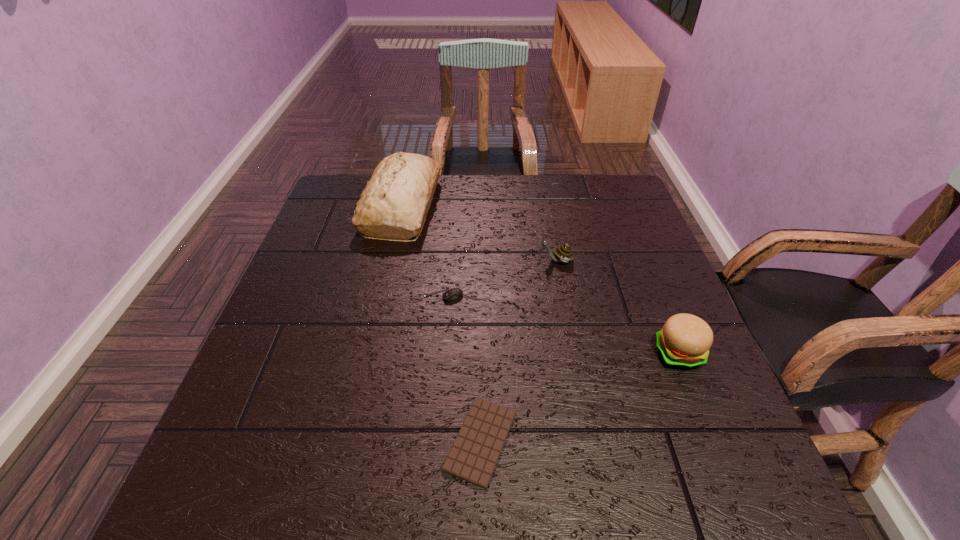
The width and height of the screenshot is (960, 540). Identify the location of vacant space located on the left of the tallest object. click(x=326, y=206).

Where is `free space located on the face of the second farthest object`? This screenshot has width=960, height=540. free space located on the face of the second farthest object is located at coordinates (409, 260).

Image resolution: width=960 pixels, height=540 pixels. In order to click on vacant region located on the face of the second farthest object in this screenshot , I will do (494, 260).

Image resolution: width=960 pixels, height=540 pixels. Identify the location of vacant position located on the face of the second farthest object. (502, 260).

You are a GUI agent. You are given a task and a screenshot of the screen. Output one action in this format:
    pyautogui.click(x=<x>, y=<y>)
    Task: Click on the free location located on the back of the second nearest object
    This screenshot has width=960, height=540.
    Given the screenshot: What is the action you would take?
    pyautogui.click(x=638, y=255)

Find the location of a particular element. vacant position located 0.150m on the front of the third nearest object is located at coordinates (438, 359).

Image resolution: width=960 pixels, height=540 pixels. In order to click on free spot located on the right of the chocolate bar in this screenshot , I will do `click(700, 441)`.

The height and width of the screenshot is (540, 960). Identify the location of object that is at the far edge. (394, 204).

Locate an element on the screen. object that is at the near edge is located at coordinates 473,456.

Where is `object that is positioned at the left edge`? The width and height of the screenshot is (960, 540). object that is positioned at the left edge is located at coordinates (394, 204).